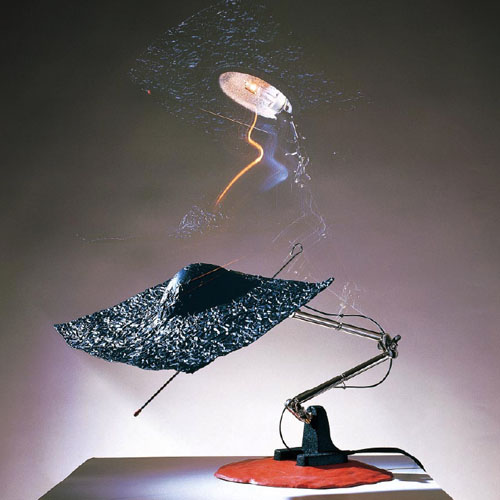
At what (x,y) coordinates should I click in order to perform the action: click on round brown plastic at base of lamp. Please return your answer as a coordinate pair (x, y). Looking at the image, I should click on (272, 466).